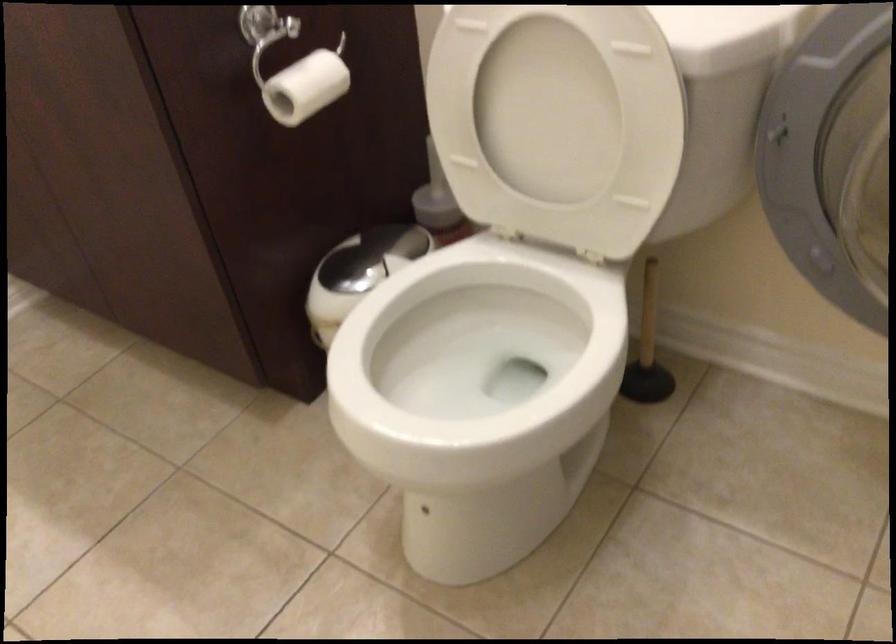
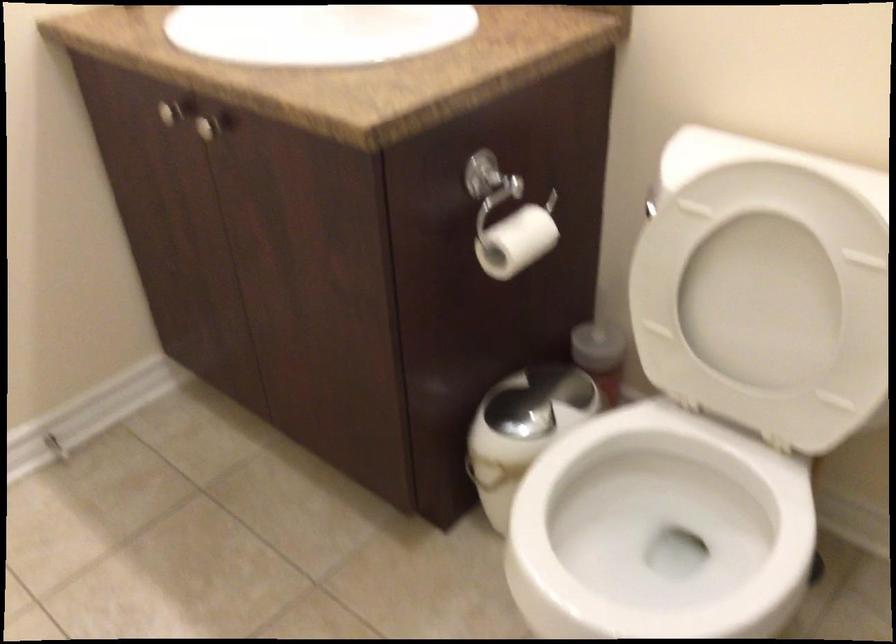
Question: The images are taken continuously from a first-person perspective. In which direction is your viewpoint rotating?

Choices:
 (A) Left
 (B) Right
 (C) Up
 (D) Down

Answer: (C)